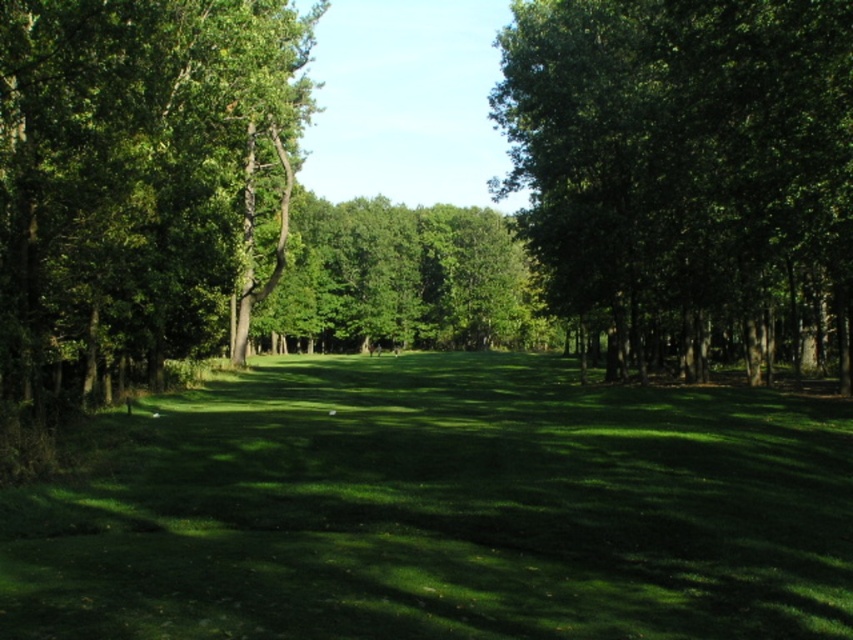
The width and height of the screenshot is (853, 640). What are the coordinates of `green grass at center` in the screenshot? It's located at (444, 512).

Does green grass at center appear on the left side of green leafy tree at left?

No, green grass at center is not to the left of green leafy tree at left.

Which is behind, point (648, 417) or point (132, 294)?

Point (132, 294)

This screenshot has height=640, width=853. Identify the location of green grass at center. (444, 512).

In the scene shown: Which of these two, green leafy tree at left or green leafy tree at center, stands taller?

Standing taller between the two is green leafy tree at center.

Does point (227, 74) come in front of point (541, 323)?

Yes, point (227, 74) is in front of point (541, 323).

Locate an element on the screen. The width and height of the screenshot is (853, 640). green leafy tree at left is located at coordinates (135, 189).

Between green leafy tree at right and green leafy tree at left, which one is positioned lower?

green leafy tree at left is lower down.

You are a GUI agent. You are given a task and a screenshot of the screen. Output one action in this format:
    pyautogui.click(x=<x>, y=<y>)
    Task: Click on the green leafy tree at right
    The width and height of the screenshot is (853, 640).
    Given the screenshot: What is the action you would take?
    pyautogui.click(x=685, y=170)

Who is more forward, (683, 259) or (4, 40)?

Point (4, 40) is in front.

What are the coordinates of `green leafy tree at right` in the screenshot? It's located at (685, 170).